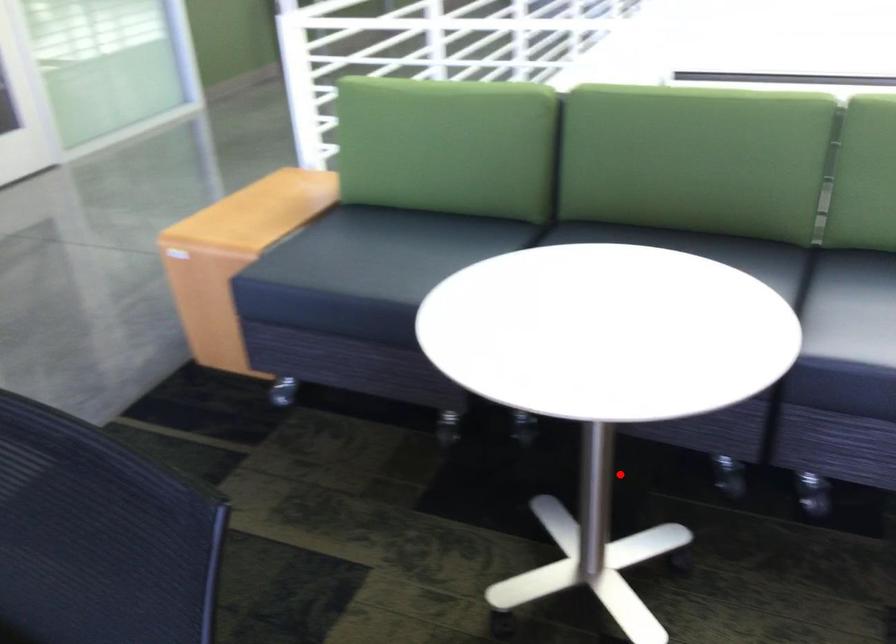
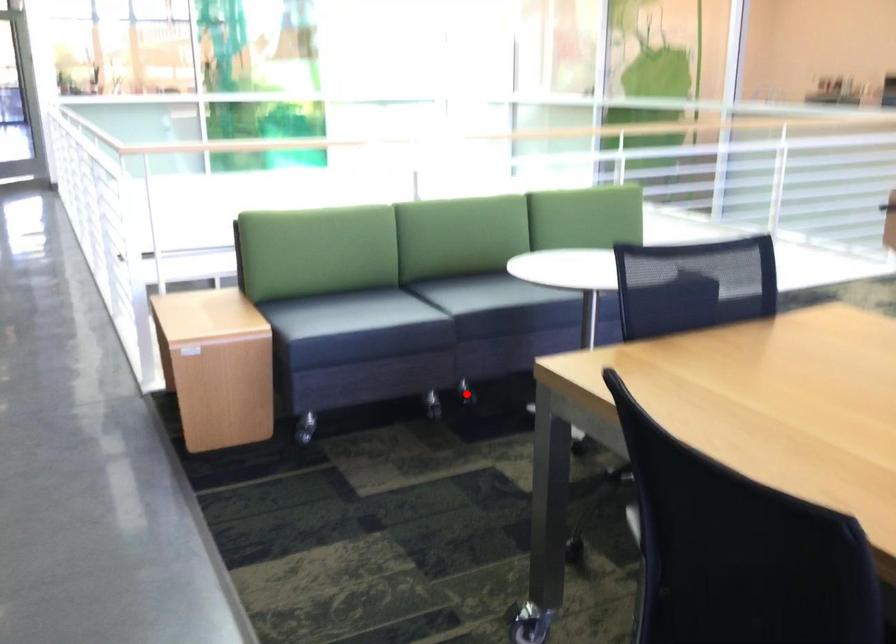
I am providing you with two images of the same scene from different viewpoints. A red point is marked on the first image and another point is marked on the second image. Does the point marked in image1 correspond to the same location as the one in image2?

Yes